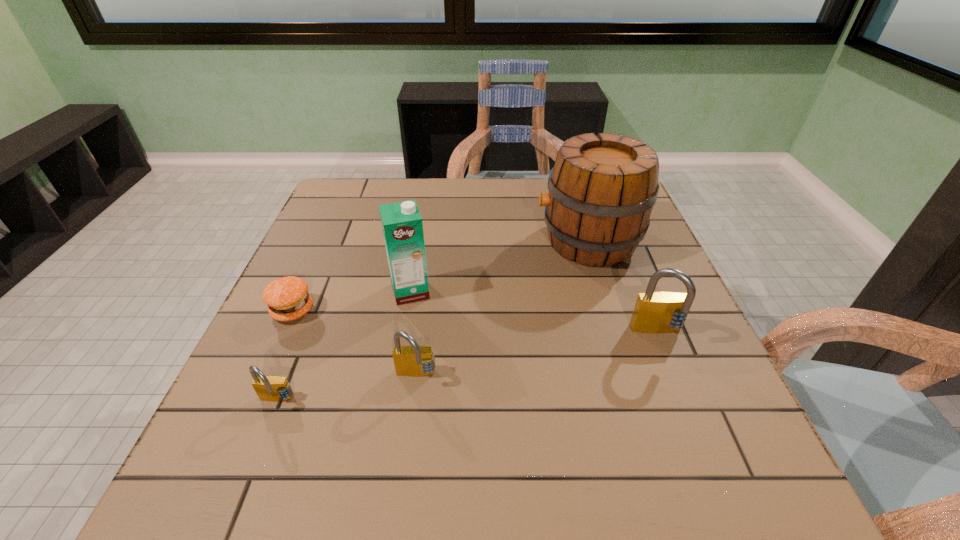
Where is `vacant space situated 0.060m on the side with the combination dials of the second padlock from right to left`? vacant space situated 0.060m on the side with the combination dials of the second padlock from right to left is located at coordinates (411, 416).

The image size is (960, 540). Identify the location of free space located on the side with the combination dials of the rightmost padlock. click(684, 397).

The height and width of the screenshot is (540, 960). Identify the location of blank space located 0.240m on the back of the shortest object. (326, 234).

You are a GUI agent. You are given a task and a screenshot of the screen. Output one action in this format:
    pyautogui.click(x=<x>, y=<y>)
    Task: Click on the blank space located 0.050m on the side of the farthest object where the spigot is located
    Image resolution: width=960 pixels, height=540 pixels.
    Given the screenshot: What is the action you would take?
    pyautogui.click(x=516, y=241)

The height and width of the screenshot is (540, 960). In order to click on free space located 0.060m on the side of the farthest object where the spigot is located in this screenshot , I will do `click(513, 241)`.

In order to click on vacant space located 0.180m on the side of the farthest object where the spigot is located in this screenshot , I will do `click(468, 241)`.

Locate an element on the screen. The width and height of the screenshot is (960, 540). free space located 0.050m on the back of the carton is located at coordinates (416, 265).

I want to click on object that is at the far edge, so click(602, 189).

Find the location of a particular element. The image size is (960, 540). object at the near edge is located at coordinates (268, 388).

Locate an element on the screen. The height and width of the screenshot is (540, 960). padlock that is at the left edge is located at coordinates tap(268, 388).